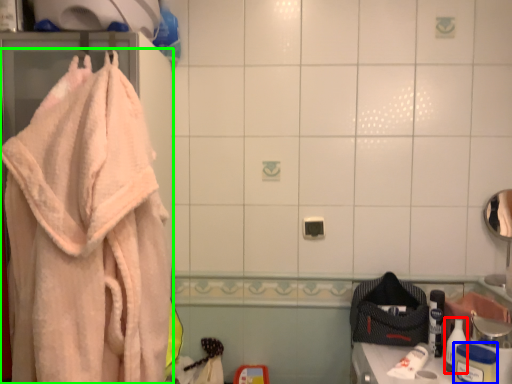
Question: Based on their relative distances, which object is farther from toiletry (highlighted by a red box)? Choose from toiletry (highlighted by a blue box) and towel (highlighted by a green box).

Choices:
 (A) toiletry
 (B) towel

Answer: (B)